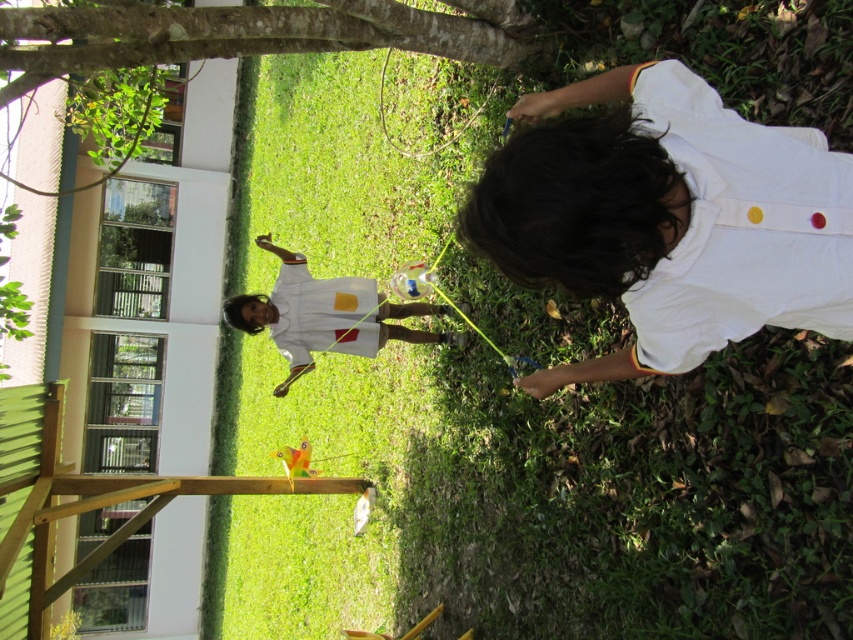
Question: Does white cotton shirt at center appear under white matte shirt at center?

Choices:
 (A) no
 (B) yes

Answer: (A)

Question: Which object is closer to the camera taking this photo?

Choices:
 (A) white cotton shirt at center
 (B) green grass at center

Answer: (A)

Question: Among these points, which one is farthest from the camera?

Choices:
 (A) (579, 250)
 (B) (735, 380)
 (C) (276, 308)

Answer: (C)

Question: Which point is closer to the camera taking this photo?

Choices:
 (A) (838, 125)
 (B) (671, 364)

Answer: (B)

Question: Can you confirm if green grass at center is positioned to the left of white cotton shirt at center?

Choices:
 (A) no
 (B) yes

Answer: (B)

Question: Is green grass at center closer to camera compared to white cotton shirt at center?

Choices:
 (A) yes
 (B) no

Answer: (B)